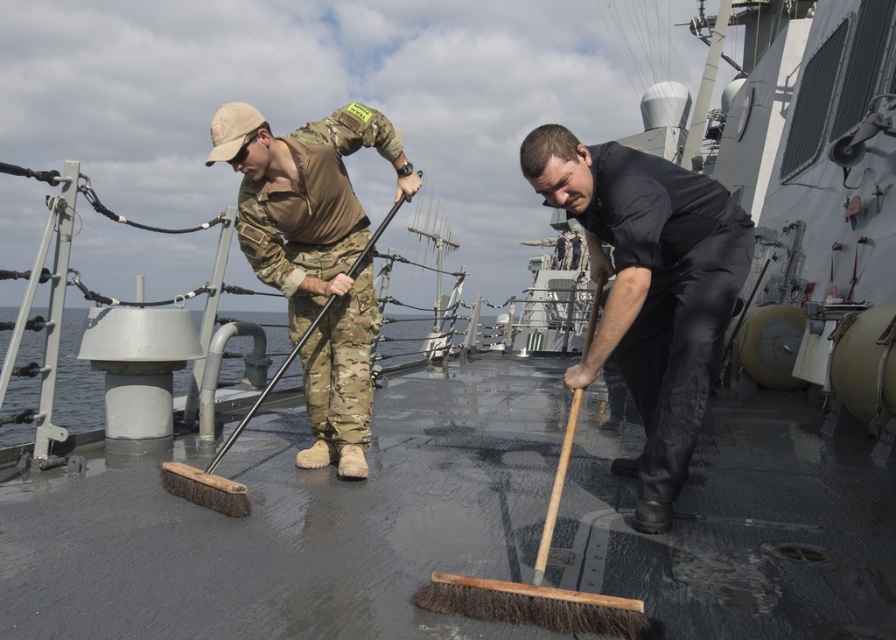
Question: Is black matte broom at center thinner than camouflage fabric uniform at center?

Choices:
 (A) yes
 (B) no

Answer: (A)

Question: Which point is closer to the camera taking this photo?

Choices:
 (A) (214, 113)
 (B) (678, 177)

Answer: (B)

Question: Can you confirm if black matte broom at center is smaller than camouflage fabric uniform at center?

Choices:
 (A) no
 (B) yes

Answer: (B)

Question: Observing the image, what is the correct spatial positioning of black matte broom at center in reference to camouflage fabric uniform at center?

Choices:
 (A) left
 (B) right

Answer: (B)